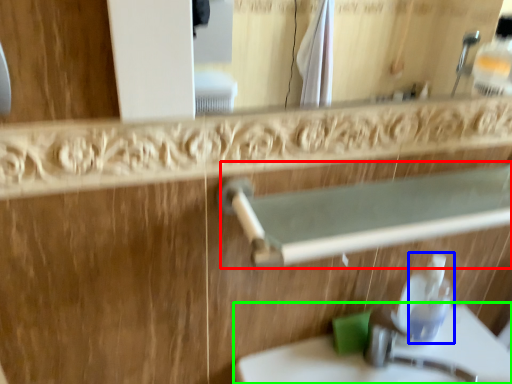
Question: Based on their relative distances, which object is nearer to balustrade (highlighted by a red box)? Choose from soap dispenser (highlighted by a blue box) and sink (highlighted by a green box).

Choices:
 (A) soap dispenser
 (B) sink

Answer: (A)